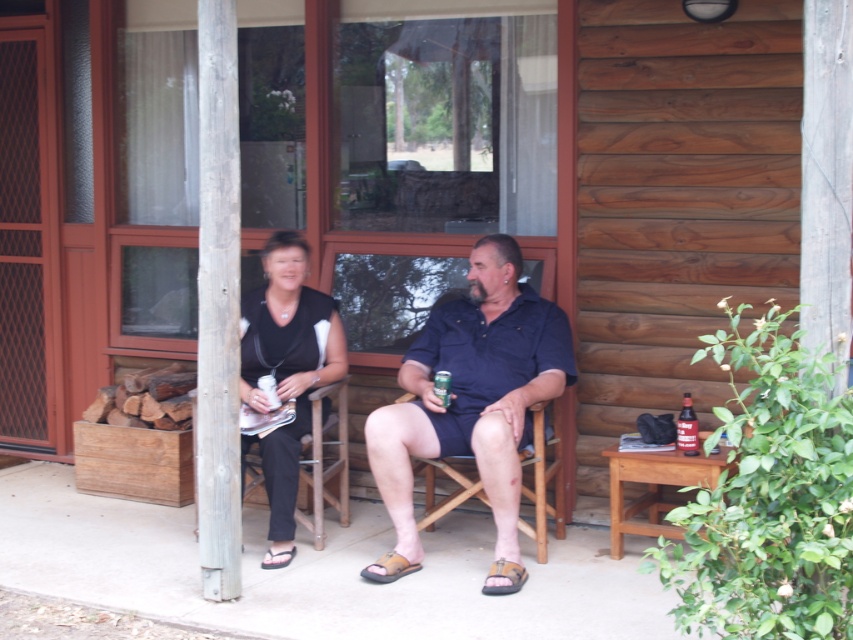
You are a delivery robot with a package that needs to be placed between the dark blue shirt at center and the wooden chair at center. The package measures 16 inches in length. Can you fit the package between them?

The distance between the dark blue shirt at center and the wooden chair at center is 15.85 inches. Since the package is 16 inches long, it cannot fit between them as the space is slightly smaller than the package.

You are a shoe designer observing the porch scene. You notice the brown leather sandal at center and the brown suede sandal at lower center. Which sandal would you recommend for someone who prefers a larger size option?

The brown leather sandal at center has a larger size compared to the brown suede sandal at lower center, so it would be the better recommendation for someone preferring a larger size.

You are trying to decide which brown leather sandal to wear today. You have two options shown in the image. The first is the brown leather sandal at center, and the second is the brown leather sandal at lower center. Based on their sizes, which one do you think would be more comfortable for walking long distances?

The brown leather sandal at center might be wider than brown leather sandal at lower center, so it could provide more comfort for walking long distances due to its wider design.